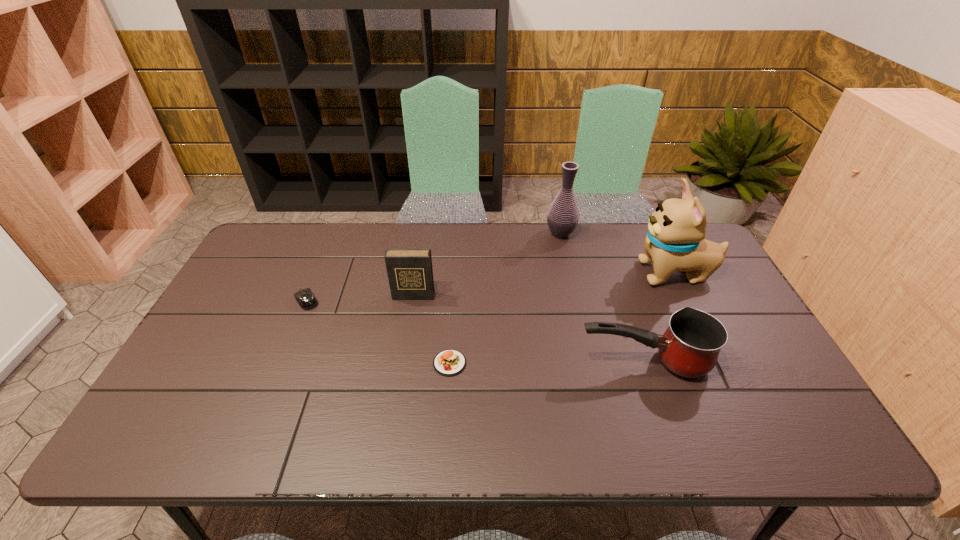
Where is `vacant region located on the face of the puppy`? The width and height of the screenshot is (960, 540). vacant region located on the face of the puppy is located at coordinates (610, 274).

At what (x,y) coordinates should I click in order to perform the action: click on free space located 0.330m on the face of the puppy. Please return your answer as a coordinate pair (x, y). This screenshot has height=540, width=960. Looking at the image, I should click on (530, 274).

The height and width of the screenshot is (540, 960). In order to click on blank area located 0.350m on the right of the farthest object in this screenshot , I will do `click(675, 234)`.

Where is `free space located 0.060m on the front cover of the fifth object from right to left`? This screenshot has height=540, width=960. free space located 0.060m on the front cover of the fifth object from right to left is located at coordinates (410, 315).

Locate an element on the screen. vacant space located on the handle side of the saucepan is located at coordinates (495, 361).

What are the coordinates of `vacant space situated 0.060m on the handle side of the saucepan` in the screenshot? It's located at (553, 361).

At what (x,y) coordinates should I click in order to perform the action: click on vacant area situated 0.050m on the handle side of the saucepan. Please return your answer as a coordinate pair (x, y). The width and height of the screenshot is (960, 540). Looking at the image, I should click on (557, 361).

Find the location of `vacant region located 0.230m on the back of the second shortest object`. vacant region located 0.230m on the back of the second shortest object is located at coordinates (329, 245).

You are a GUI agent. You are given a task and a screenshot of the screen. Output one action in this format:
    pyautogui.click(x=<x>, y=<y>)
    Task: Click on the free region located on the front of the patty (food)
    This screenshot has height=540, width=960.
    Given the screenshot: What is the action you would take?
    pyautogui.click(x=447, y=401)

What are the coordinates of `puppy located in the far edge section of the desktop` in the screenshot? It's located at (675, 241).